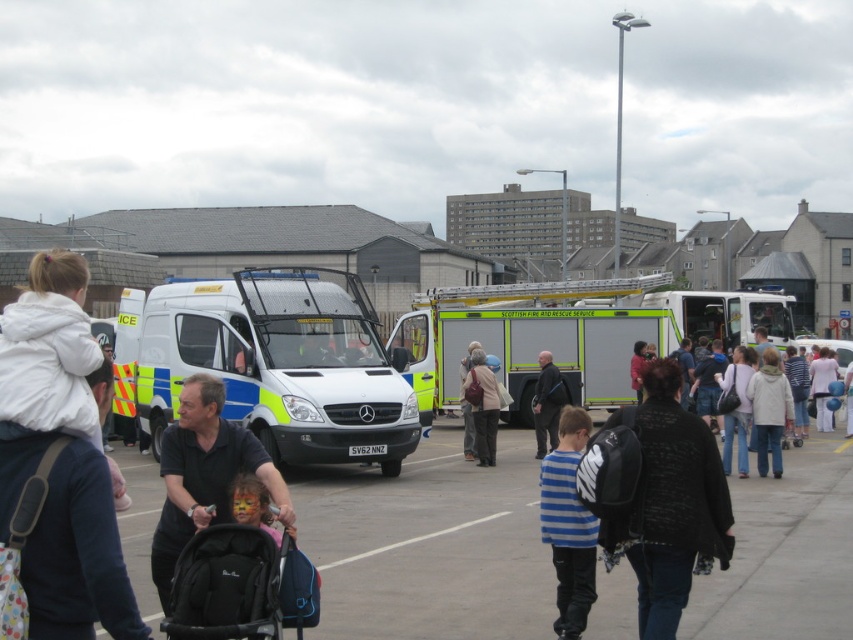
Question: Is blue striped shirt at center smaller than light brown leather jacket at center?

Choices:
 (A) no
 (B) yes

Answer: (A)

Question: Which is nearer to the white fleece jacket at upper left?

Choices:
 (A) light blue fabric balloon at center
 (B) light beige jacket at center

Answer: (B)

Question: Among these objects, which one is farthest from the camera?

Choices:
 (A) black fabric baby carriage at center
 (B) light brown leather jacket at center

Answer: (B)

Question: Where is dark blue jacket at center located in relation to matte pink face paint at center in the image?

Choices:
 (A) left
 (B) right

Answer: (B)

Question: Where is black backpack at center located in relation to blue striped shirt at center in the image?

Choices:
 (A) left
 (B) right

Answer: (B)

Question: Which point is closer to the camera?

Choices:
 (A) (537, 392)
 (B) (483, 365)
 (C) (849, 433)
 (D) (579, 317)

Answer: (B)